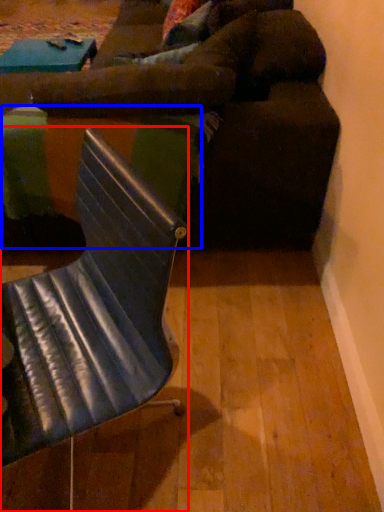
Question: Which object appears farthest to the camera in this image, chair (highlighted by a red box) or table (highlighted by a blue box)?

Choices:
 (A) chair
 (B) table

Answer: (B)